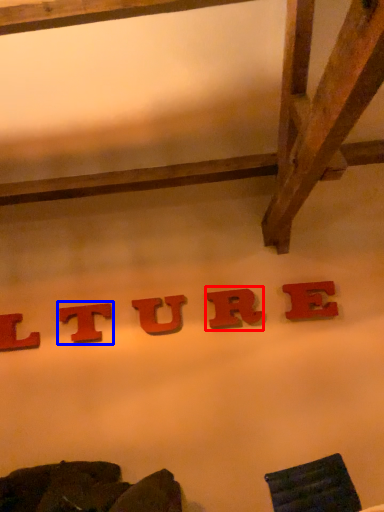
Question: Among these objects, which one is nearest to the camera, letter (highlighted by a red box) or letter (highlighted by a blue box)?

Choices:
 (A) letter
 (B) letter

Answer: (A)